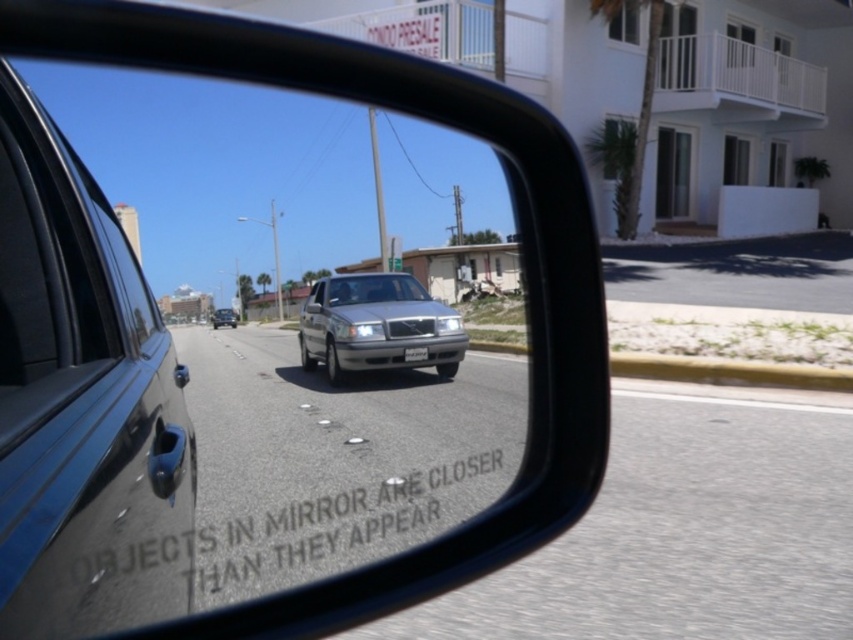
You are driving a car and notice two sedans reflected in your side mirror. The mirror warns that objects are closer than they appear. You see a satin silver sedan at center and a silver metallic sedan at center. Which sedan is wider according to the mirror?

The silver metallic sedan at center is wider than the satin silver sedan at center.

You are a driver checking your side mirror, which warns that objects are closer than they appear. You notice two points reflected in the mirror at coordinates point [200,54] and point [407,310]. Which point is actually closer to your car?

Point [200,54] is closer to the camera than point [407,310], so the point at [200,54] is actually closer to your car.